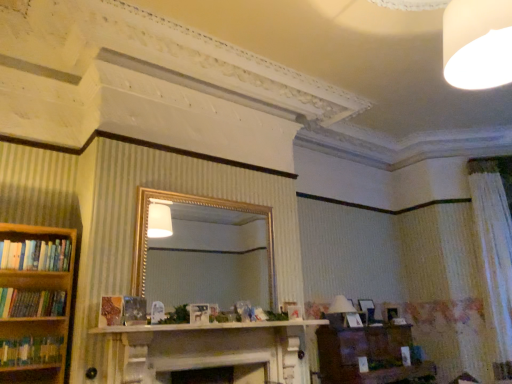
Question: From a real-world perspective, does white textured curtain at right stand above brown wooden vanity at lower right?

Choices:
 (A) yes
 (B) no

Answer: (A)

Question: From the image's perspective, does white textured curtain at right appear lower than brown wooden vanity at lower right?

Choices:
 (A) no
 (B) yes

Answer: (A)

Question: Does white textured curtain at right have a greater height compared to brown wooden vanity at lower right?

Choices:
 (A) yes
 (B) no

Answer: (A)

Question: Does white textured curtain at right turn towards brown wooden vanity at lower right?

Choices:
 (A) no
 (B) yes

Answer: (A)

Question: Is white textured curtain at right not inside brown wooden vanity at lower right?

Choices:
 (A) no
 (B) yes

Answer: (B)

Question: Considering their positions, is brown wooden vanity at lower right located in front of or behind white fabric lampshade at lower right?

Choices:
 (A) front
 (B) behind

Answer: (A)

Question: Based on their sizes in the image, would you say brown wooden vanity at lower right is bigger or smaller than white fabric lampshade at lower right?

Choices:
 (A) small
 (B) big

Answer: (B)

Question: From a real-world perspective, is brown wooden vanity at lower right positioned above or below white fabric lampshade at lower right?

Choices:
 (A) above
 (B) below

Answer: (B)

Question: From the image's perspective, is brown wooden vanity at lower right above or below white fabric lampshade at lower right?

Choices:
 (A) above
 (B) below

Answer: (B)

Question: From a real-world perspective, is hardcover books at left, the third book from the top, positioned above or below brown wooden vanity at lower right?

Choices:
 (A) above
 (B) below

Answer: (A)

Question: In the image, is hardcover books at left, marked as the 1th book in a bottom-to-top arrangement, on the left side or the right side of brown wooden vanity at lower right?

Choices:
 (A) left
 (B) right

Answer: (A)

Question: Based on their sizes in the image, would you say hardcover books at left, the third book from the top, is bigger or smaller than brown wooden vanity at lower right?

Choices:
 (A) small
 (B) big

Answer: (A)

Question: Looking at their shapes, would you say hardcover books at left, marked as the 1th book in a bottom-to-top arrangement, is wider or thinner than brown wooden vanity at lower right?

Choices:
 (A) wide
 (B) thin

Answer: (B)

Question: From a real-world perspective, relative to white marble mantle at center, is white frosted bulb at upper right vertically above or below?

Choices:
 (A) above
 (B) below

Answer: (A)

Question: Considering the positions of point 492,43 and point 250,326, is point 492,43 closer or farther from the camera than point 250,326?

Choices:
 (A) closer
 (B) farther

Answer: (A)